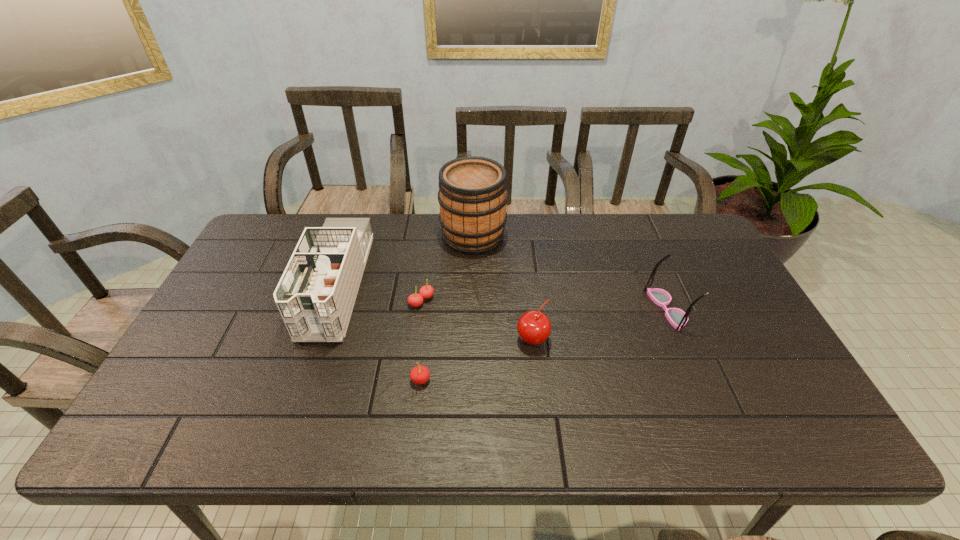
This screenshot has width=960, height=540. What are the coordinates of `vacant space that's between the farthest cherry and the dollhouse` in the screenshot? It's located at (379, 293).

The height and width of the screenshot is (540, 960). What are the coordinates of `free space between the second object from right to left and the second tallest cherry` in the screenshot? It's located at (476, 359).

At what (x,y) coordinates should I click in order to perform the action: click on the fourth closest object to the second farthest cherry. Please return your answer as a coordinate pair (x, y). This screenshot has height=540, width=960. Looking at the image, I should click on (677, 318).

The width and height of the screenshot is (960, 540). Find the location of `object that is the second closest to the shortest cherry`. object that is the second closest to the shortest cherry is located at coordinates (472, 194).

Identify which cherry is the second nearest to the second shortest cherry. Please provide its 2D coordinates. Your answer should be formatted as a tuple, i.e. [(x, y)], where the tuple contains the x and y coordinates of a point satisfying the conditions above.

[(534, 327)]

Identify the location of the second closest cherry to the rightmost cherry. (426, 291).

You are a GUI agent. You are given a task and a screenshot of the screen. Output one action in this format:
    pyautogui.click(x=<x>, y=<y>)
    Task: Click on the free space that satisfies the following two spatial constraints: 1. on the front side of the second shortest object; 2. on the left side of the shortest object
    
    Given the screenshot: What is the action you would take?
    pyautogui.click(x=411, y=380)

The width and height of the screenshot is (960, 540). Identify the location of vacant space that satisfies the following two spatial constraints: 1. at the entrance of the spectacles; 2. on the left side of the dollhouse. (327, 309).

Image resolution: width=960 pixels, height=540 pixels. Find the location of `free location that satisfies the following two spatial constraints: 1. on the front side of the nearest object; 2. on the left side of the shortest object`. free location that satisfies the following two spatial constraints: 1. on the front side of the nearest object; 2. on the left side of the shortest object is located at coordinates (411, 380).

Identify the location of vacant region that satisfies the following two spatial constraints: 1. on the back side of the shortest object; 2. on the left side of the tallest object. This screenshot has height=540, width=960. (430, 236).